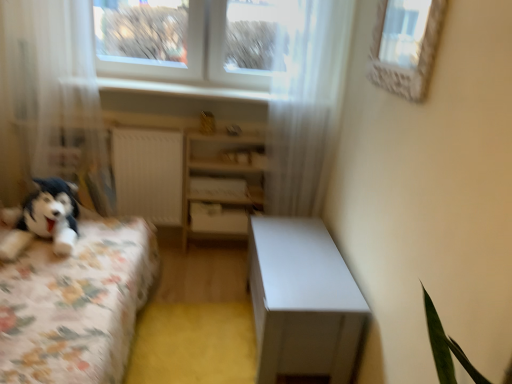
Question: Is fluffy fabric bed at left at the right side of white sheer curtain at left, which is the 1th curtain in left-to-right order?

Choices:
 (A) yes
 (B) no

Answer: (A)

Question: From a real-world perspective, is fluffy fabric bed at left beneath white sheer curtain at left, the 2th curtain when ordered from right to left?

Choices:
 (A) yes
 (B) no

Answer: (A)

Question: Is fluffy fabric bed at left surrounding white sheer curtain at left, which is the 1th curtain in left-to-right order?

Choices:
 (A) no
 (B) yes

Answer: (A)

Question: Is the surface of fluffy fabric bed at left in direct contact with white sheer curtain at left, which is the 1th curtain in left-to-right order?

Choices:
 (A) no
 (B) yes

Answer: (A)

Question: Is fluffy fabric bed at left in front of white sheer curtain at left, which is the 1th curtain in left-to-right order?

Choices:
 (A) yes
 (B) no

Answer: (A)

Question: Does fluffy fabric bed at left have a greater height compared to white sheer curtain at left, which is the 1th curtain in left-to-right order?

Choices:
 (A) no
 (B) yes

Answer: (A)

Question: From a real-world perspective, is fluffy fabric bed at left located beneath white glossy table at center?

Choices:
 (A) no
 (B) yes

Answer: (A)

Question: Are fluffy fabric bed at left and white glossy table at center beside each other?

Choices:
 (A) yes
 (B) no

Answer: (B)

Question: Is fluffy fabric bed at left taller than white glossy table at center?

Choices:
 (A) yes
 (B) no

Answer: (A)

Question: Can you confirm if fluffy fabric bed at left is wider than white glossy table at center?

Choices:
 (A) yes
 (B) no

Answer: (A)

Question: Does fluffy fabric bed at left come in front of white glossy table at center?

Choices:
 (A) yes
 (B) no

Answer: (A)

Question: Is fluffy fabric bed at left oriented away from white glossy table at center?

Choices:
 (A) no
 (B) yes

Answer: (A)

Question: Is white glossy table at center not close to white matte drawer at center?

Choices:
 (A) yes
 (B) no

Answer: (B)